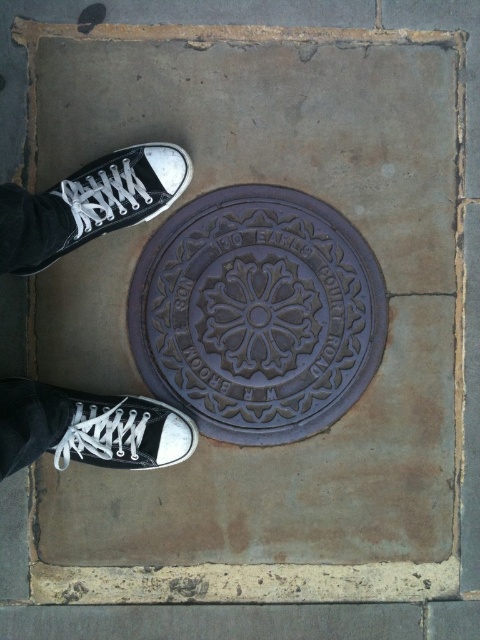
Can you confirm if purple cast iron manhole at center is positioned below black canvas shoe at lower left?

No, purple cast iron manhole at center is not below black canvas shoe at lower left.

Which is more to the left, purple cast iron manhole at center or black canvas shoe at lower left?

Positioned to the left is black canvas shoe at lower left.

Identify the location of purple cast iron manhole at center. The height and width of the screenshot is (640, 480). (256, 314).

Does purple cast iron manhole at center have a larger size compared to white canvas shoe at lower left?

Indeed, purple cast iron manhole at center has a larger size compared to white canvas shoe at lower left.

Where is `purple cast iron manhole at center`? The image size is (480, 640). purple cast iron manhole at center is located at coordinates (256, 314).

Which is behind, point (332, 228) or point (68, 454)?

The point (332, 228) is more distant.

Locate an element on the screen. Image resolution: width=480 pixels, height=640 pixels. purple cast iron manhole at center is located at coordinates (256, 314).

Is black canvas shoe at center closer to the viewer compared to white canvas shoe at lower left?

No, black canvas shoe at center is further to the viewer.

Who is more forward, (106, 186) or (137, 465)?

Point (106, 186) is more forward.

In order to click on black canvas shoe at center in this screenshot , I will do `click(120, 193)`.